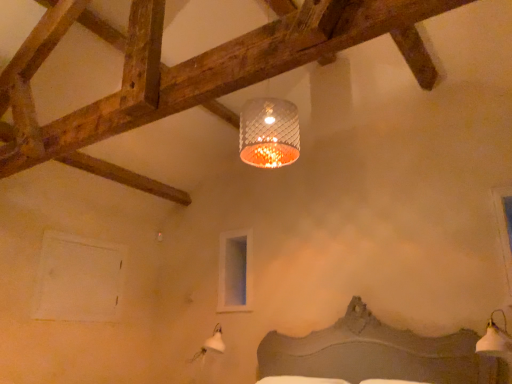
Question: In which direction should I rotate to look at clear glass window at upper center, which is the 2th window in right-to-left order?

Choices:
 (A) left
 (B) right

Answer: (A)

Question: Is the depth of white matte window at lower left, marked as the 2th window in a back-to-front arrangement, less than that of white glossy lampshade at lower right?

Choices:
 (A) yes
 (B) no

Answer: (B)

Question: Is white matte window at lower left, marked as the 2th window in a back-to-front arrangement, outside white glossy lampshade at lower right?

Choices:
 (A) yes
 (B) no

Answer: (A)

Question: From a real-world perspective, is white matte window at lower left, the second window positioned from the front, physically below white glossy lampshade at lower right?

Choices:
 (A) no
 (B) yes

Answer: (A)

Question: Is white matte window at lower left, marked as the 2th window in a back-to-front arrangement, thinner than white glossy lampshade at lower right?

Choices:
 (A) yes
 (B) no

Answer: (A)

Question: From the image's perspective, is white matte window at lower left, which is counted as the third window, starting from the right, beneath white glossy lampshade at lower right?

Choices:
 (A) no
 (B) yes

Answer: (A)

Question: Is white matte window at lower left, placed as the 1th window when sorted from left to right, aimed at white glossy lampshade at lower right?

Choices:
 (A) yes
 (B) no

Answer: (A)

Question: Does transparent glass window at upper right, which is the first window from right to left, have a greater width compared to white glossy lampshade at lower right?

Choices:
 (A) no
 (B) yes

Answer: (A)

Question: Is transparent glass window at upper right, positioned as the 1th window in front-to-back order, bigger than white glossy lampshade at lower right?

Choices:
 (A) no
 (B) yes

Answer: (A)

Question: From the image's perspective, is transparent glass window at upper right, the third window in the back-to-front sequence, below white glossy lampshade at lower right?

Choices:
 (A) yes
 (B) no

Answer: (B)

Question: Is transparent glass window at upper right, which is the first window from right to left, placed right next to white glossy lampshade at lower right?

Choices:
 (A) yes
 (B) no

Answer: (B)

Question: From the image's perspective, is transparent glass window at upper right, the 3th window from the left, on top of white glossy lampshade at lower right?

Choices:
 (A) no
 (B) yes

Answer: (B)

Question: Considering the relative sizes of transparent glass window at upper right, positioned as the 1th window in front-to-back order, and white glossy lampshade at lower right in the image provided, is transparent glass window at upper right, positioned as the 1th window in front-to-back order, shorter than white glossy lampshade at lower right?

Choices:
 (A) yes
 (B) no

Answer: (B)

Question: Is white glossy lampshade at lower right bigger than clear glass window at upper center, marked as the second window in a left-to-right arrangement?

Choices:
 (A) yes
 (B) no

Answer: (A)